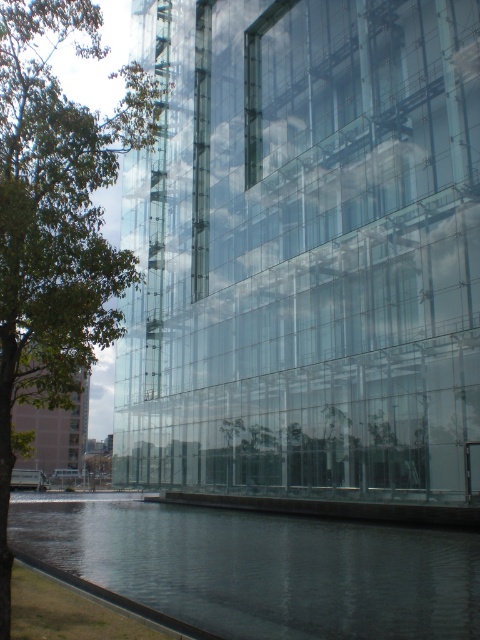
Is point (308, 522) positioned before point (71, 285)?

That is False.

Based on the photo, measure the distance from transparent glass water at lower left to green leafy tree at left.

They are 8.94 meters apart.

Find the location of a particular element. Image resolution: width=480 pixels, height=640 pixels. transparent glass water at lower left is located at coordinates (262, 566).

At what (x,y) coordinates should I click in order to perform the action: click on transparent glass water at lower left. Please return your answer as a coordinate pair (x, y). This screenshot has height=640, width=480. Looking at the image, I should click on (262, 566).